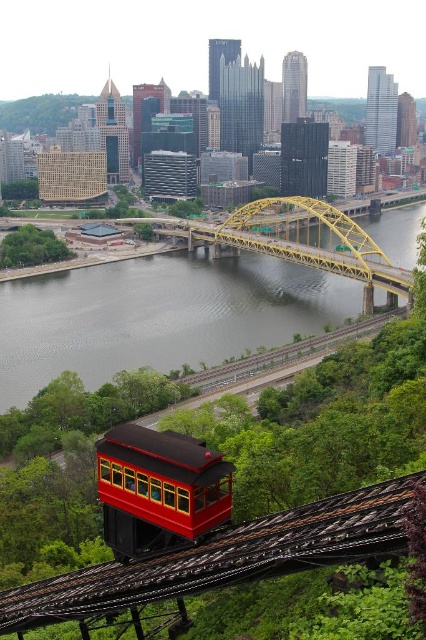
You are standing on the sidewalk near the gray concrete water at center and want to cross to the yellow steel bridge at center. Is the bridge directly behind the water from your current position?

Yes, the gray concrete water at center is in front of the yellow steel bridge at center, so the bridge is directly behind the water from your current position.

You are standing on the observation deck of the yellow bridge and looking down. You see the gray concrete water at center and the shiny red trolley car at center. Which object is closer to you?

The shiny red trolley car at center is closer to you because the gray concrete water at center is further away.

You are standing on the red and black funicular car on the incline. Looking straight ahead, you see the yellow bridge spanning the river. There is a point marked at coordinates (157,316) in your field of view. What does this point correspond to?

The point corresponds to gray concrete water at center.